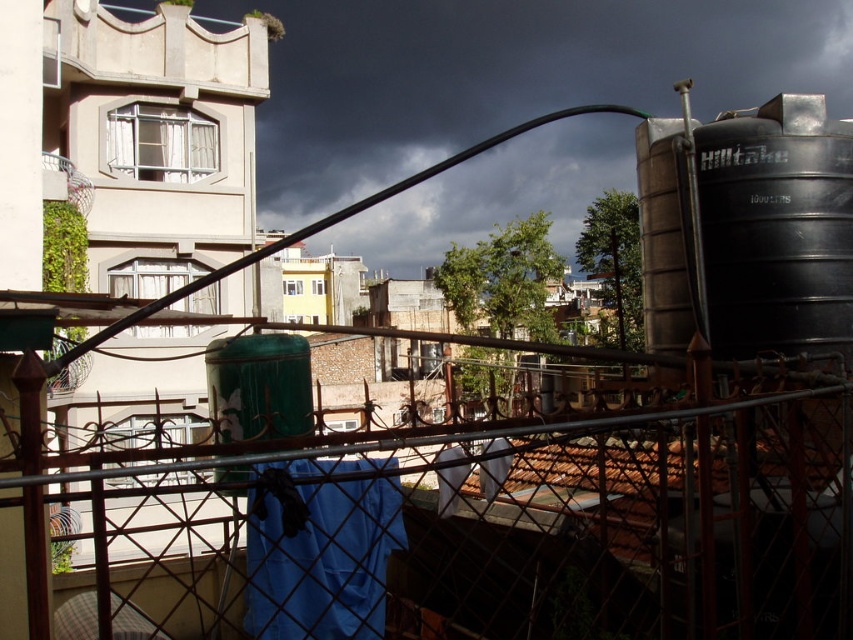
Which of these two, rusty metal fence at center or black matte water tank at right, stands shorter?

Standing shorter between the two is black matte water tank at right.

Who is taller, rusty metal fence at center or black matte water tank at right?

rusty metal fence at center is taller.

This screenshot has height=640, width=853. I want to click on rusty metal fence at center, so click(491, 522).

Image resolution: width=853 pixels, height=640 pixels. What are the coordinates of `rusty metal fence at center` in the screenshot? It's located at pyautogui.click(x=491, y=522).